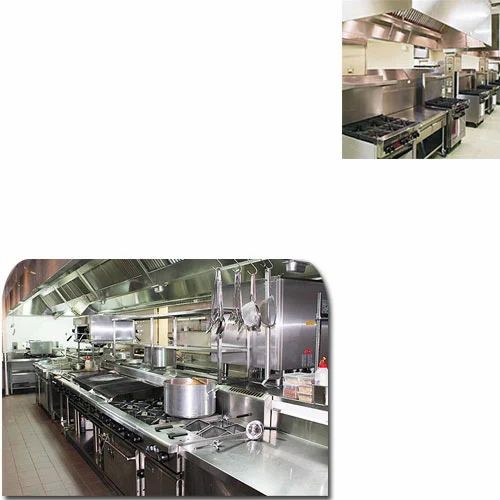
Locate an element on the screen. This screenshot has height=500, width=500. large silver pot is located at coordinates (186, 401).